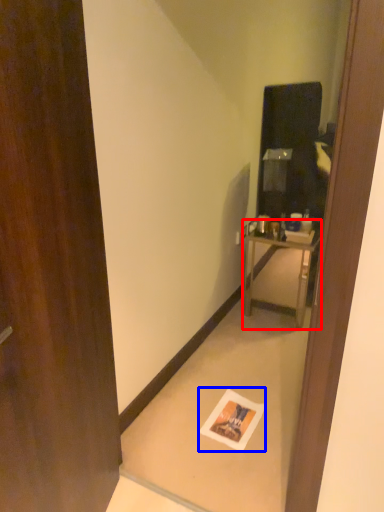
Question: Which of the following is the farthest to the observer, nightstand (highlighted by a red box) or postcard (highlighted by a blue box)?

Choices:
 (A) nightstand
 (B) postcard

Answer: (A)